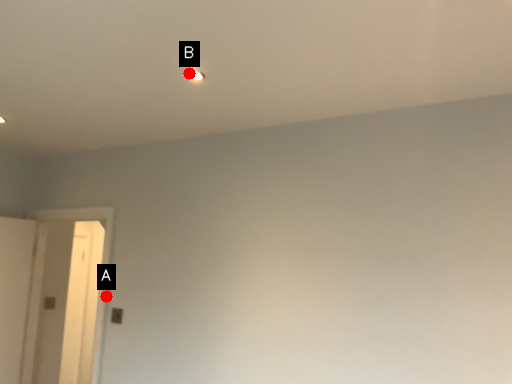
Question: Two points are circled on the image, labeled by A and B beside each circle. Which point is farther to the camera?

Choices:
 (A) A is further
 (B) B is further

Answer: (A)